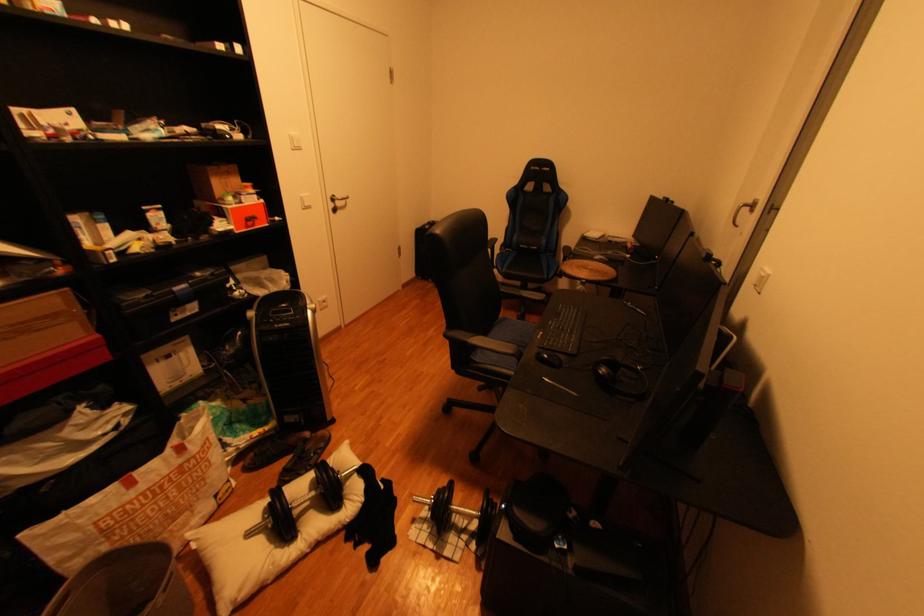
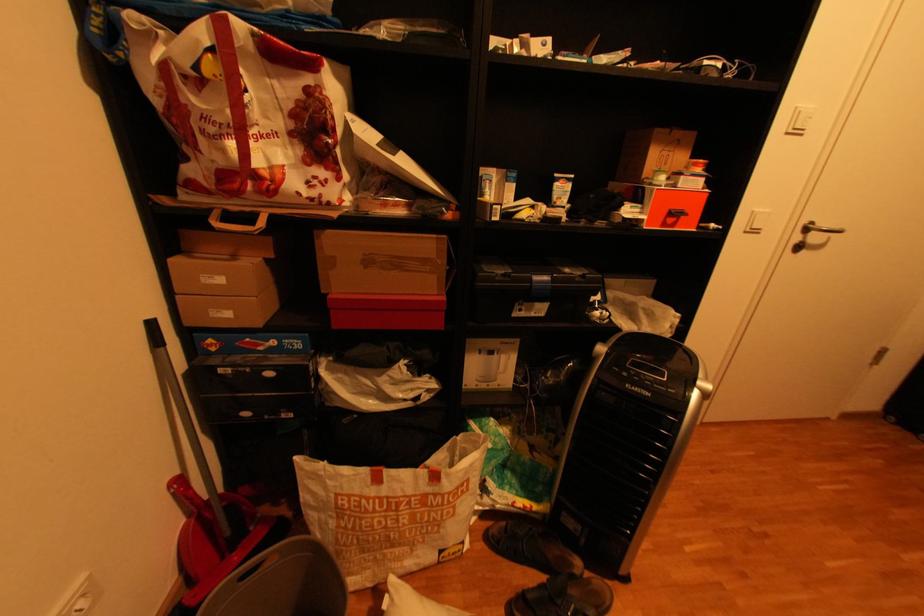
Find the pixel in the second image that matches pixel 304 151 in the first image.

(796, 134)